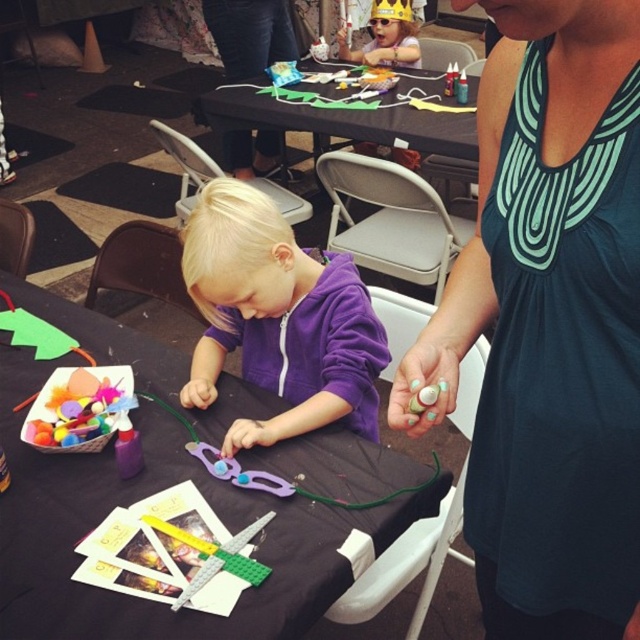
You are a participant in the craft event and need to place a 12 inch craft box on the black fabric table at center. Can the box fit on the table if the table is 36.53 inches from you?

The black fabric table at center is 36.53 inches from the viewer. Since the craft box is 12 inches long, it can easily fit on the table as the distance from the viewer does not affect the table size. The table is large enough to accommodate the box.

You are a photographer at the craft event. You want to take a photo of the purple fleece hoodie at center. The camera is 3.89 feet away from the hoodie. Is the distance sufficient to capture the entire hoodie in the frame?

The purple fleece hoodie at center and camera are 3.89 feet apart from each other. This distance is sufficient to capture the entire hoodie in the frame as long as the camera has a wide enough lens or the photographer steps back slightly for a full view.

You are organizing a craft activity for children and have a small storage box that can only hold items narrower than the purple fleece hoodie at center. Can the purple plastic scissors at center fit into the box?

The purple fleece hoodie at center is wider than the purple plastic scissors at center, so the scissors can fit into the box since they are narrower than the hoodie.